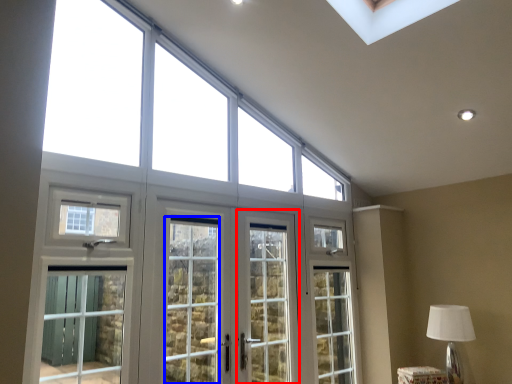
Question: Which point is further to the camera, screen door (highlighted by a red box) or screen door (highlighted by a blue box)?

Choices:
 (A) screen door
 (B) screen door

Answer: (A)